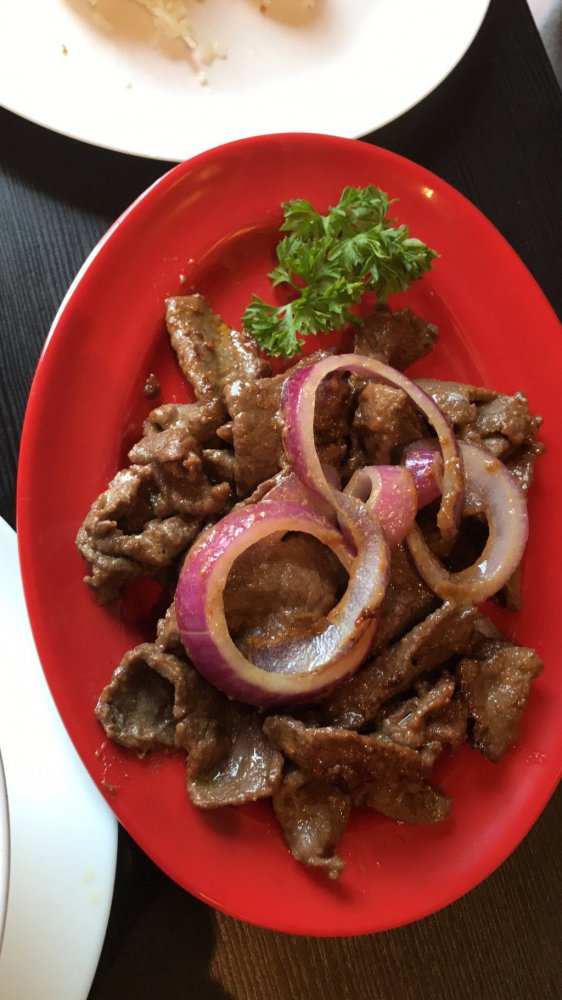
The width and height of the screenshot is (562, 1000). What are the coordinates of `white plate` in the screenshot? It's located at (83, 818).